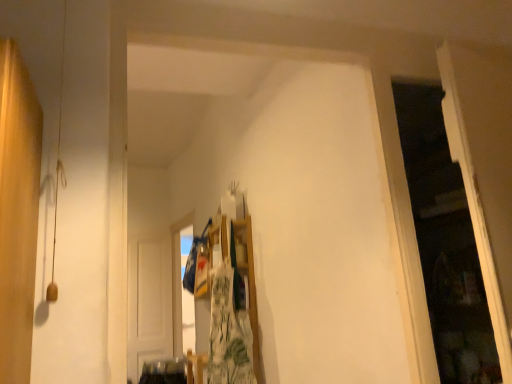
Question: In the image, is green floral fabric at center positioned in front of or behind transparent plastic window at upper center?

Choices:
 (A) front
 (B) behind

Answer: (A)

Question: From the image's perspective, is green floral fabric at center positioned above or below transparent plastic window at upper center?

Choices:
 (A) below
 (B) above

Answer: (B)

Question: Based on their relative distances, which object is farther from the green floral fabric at center?

Choices:
 (A) white wooden door at center
 (B) transparent plastic window at upper center

Answer: (A)

Question: Estimate the real-world distances between objects in this image. Which object is farther from the transparent plastic window at upper center?

Choices:
 (A) white wooden door at center
 (B) green floral fabric at center

Answer: (B)